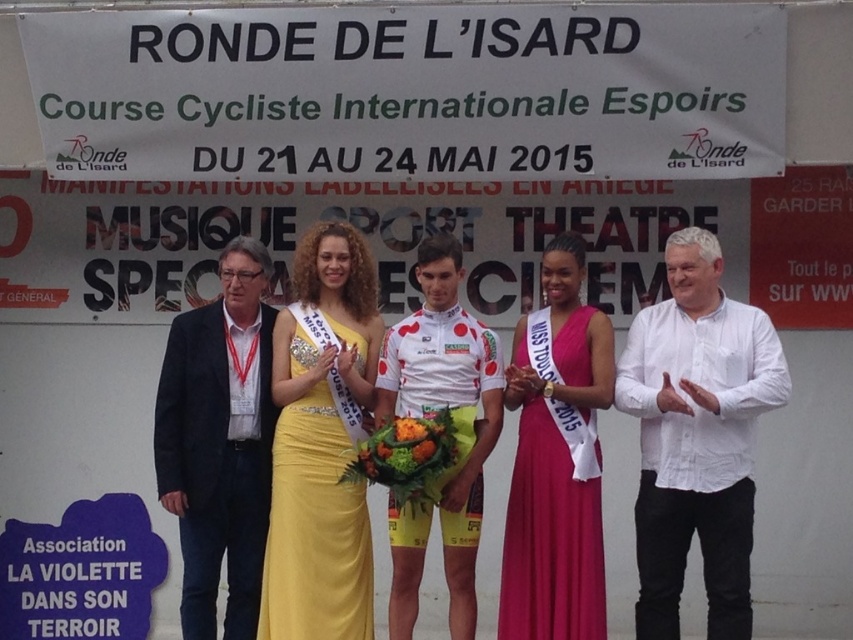
Question: Which point is farther to the camera?

Choices:
 (A) white dotted jersey at center
 (B) yellow satin dress at center

Answer: (A)

Question: Which of the following is the farthest from the observer?

Choices:
 (A) dark blue suit at left
 (B) white dotted jersey at center
 (C) yellow satin dress at center

Answer: (A)

Question: From the image, what is the correct spatial relationship of dark blue suit at left in relation to white dotted jersey at center?

Choices:
 (A) above
 (B) below

Answer: (B)

Question: Is dark blue suit at left to the left of pink satin dress at center from the viewer's perspective?

Choices:
 (A) yes
 (B) no

Answer: (A)

Question: Which point is closer to the camera?

Choices:
 (A) pink satin dress at center
 (B) dark blue suit at left
 (C) white dotted jersey at center
 (D) yellow satin dress at center

Answer: (A)

Question: Can you confirm if dark blue suit at left is positioned to the left of white dotted jersey at center?

Choices:
 (A) yes
 (B) no

Answer: (A)